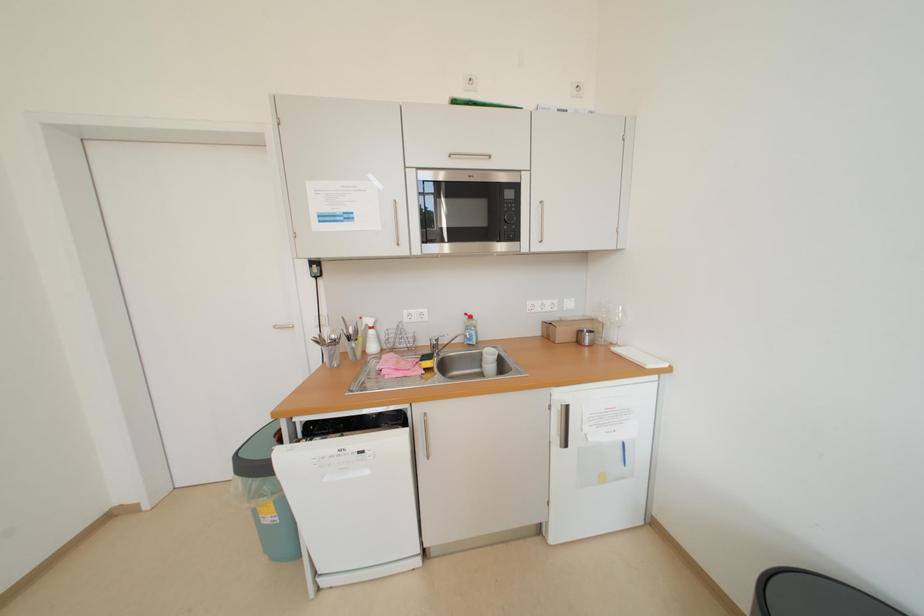
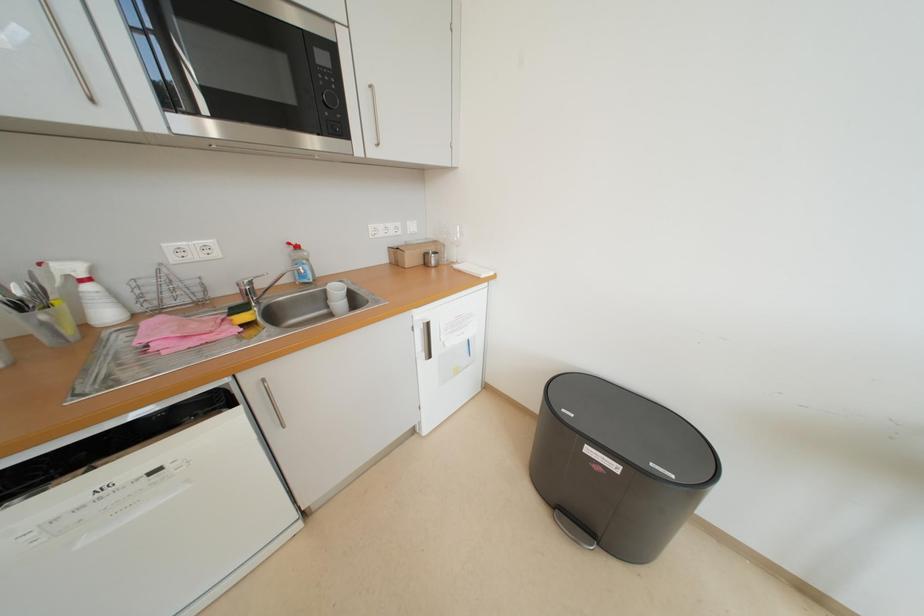
First-person continuous shooting, in which direction is the camera rotating?

The rotation direction of the camera is right-down.